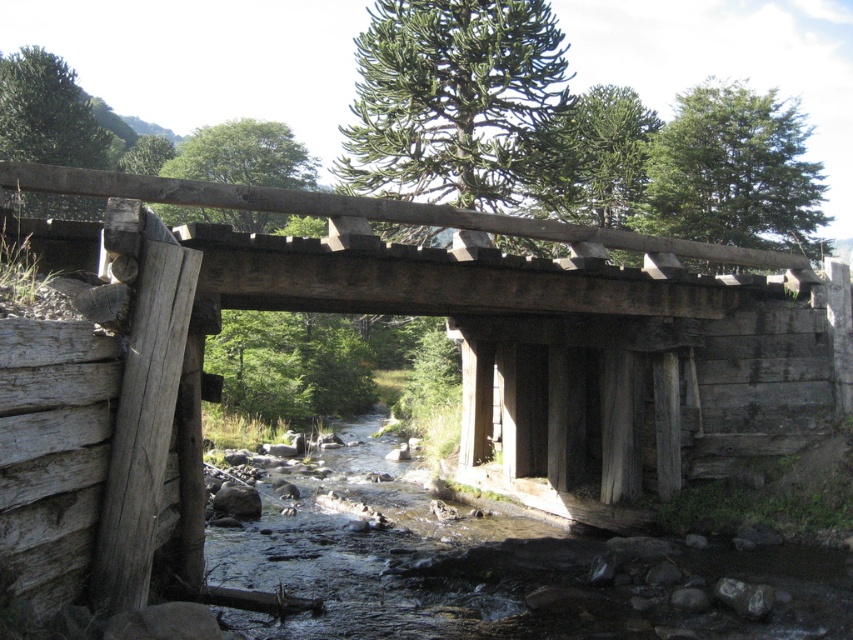
Is point (438, 292) positioned behind point (767, 630)?

Yes, point (438, 292) is behind point (767, 630).

Is point (631, 486) more distant than point (473, 579)?

Yes, it is.

Where is `weathered wood bridge at center`? The width and height of the screenshot is (853, 640). weathered wood bridge at center is located at coordinates (461, 356).